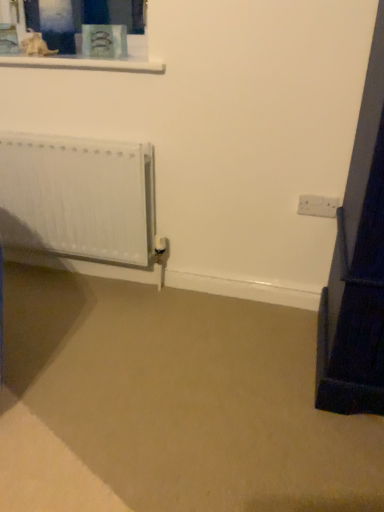
Question: Does white matte radiator at left have a greater width compared to white plastic electric outlet at right?

Choices:
 (A) yes
 (B) no

Answer: (A)

Question: Could white plastic electric outlet at right be considered to be inside white matte radiator at left?

Choices:
 (A) yes
 (B) no

Answer: (B)

Question: Could you tell me if white matte radiator at left is turned towards white plastic electric outlet at right?

Choices:
 (A) yes
 (B) no

Answer: (B)

Question: Considering the relative positions of white matte radiator at left and white plastic electric outlet at right in the image provided, is white matte radiator at left to the right of white plastic electric outlet at right from the viewer's perspective?

Choices:
 (A) yes
 (B) no

Answer: (B)

Question: From a real-world perspective, is white matte radiator at left positioned under white plastic electric outlet at right based on gravity?

Choices:
 (A) yes
 (B) no

Answer: (A)

Question: Considering the relative positions of white matte radiator at left and white plastic electric outlet at right in the image provided, is white matte radiator at left to the left of white plastic electric outlet at right from the viewer's perspective?

Choices:
 (A) yes
 (B) no

Answer: (A)

Question: Considering the relative sizes of white plastic electric outlet at right and white matte radiator at left in the image provided, is white plastic electric outlet at right taller than white matte radiator at left?

Choices:
 (A) no
 (B) yes

Answer: (A)

Question: Considering the relative sizes of white plastic electric outlet at right and white matte radiator at left in the image provided, is white plastic electric outlet at right bigger than white matte radiator at left?

Choices:
 (A) yes
 (B) no

Answer: (B)

Question: From a real-world perspective, does white plastic electric outlet at right sit lower than white matte radiator at left?

Choices:
 (A) yes
 (B) no

Answer: (B)

Question: From the image's perspective, would you say white plastic electric outlet at right is shown under white matte radiator at left?

Choices:
 (A) yes
 (B) no

Answer: (A)

Question: Considering the relative sizes of white plastic electric outlet at right and white matte radiator at left in the image provided, is white plastic electric outlet at right smaller than white matte radiator at left?

Choices:
 (A) yes
 (B) no

Answer: (A)

Question: Is white plastic electric outlet at right aimed at white matte radiator at left?

Choices:
 (A) no
 (B) yes

Answer: (A)

Question: Relative to white matte radiator at left, is white plastic electric outlet at right in front or behind?

Choices:
 (A) front
 (B) behind

Answer: (B)